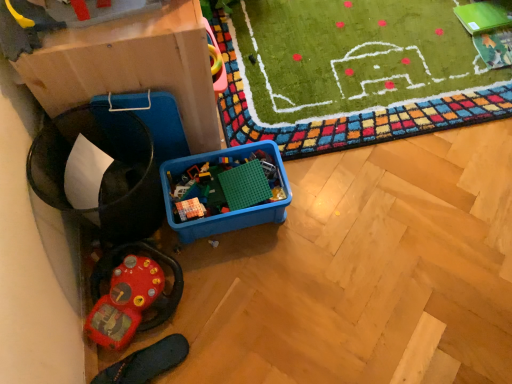
Question: Does rubberized red steering wheel at lower left, which ranks as the first toy in bottom-to-top order, contain blue plastic container at center, placed as the first toy when sorted from right to left?

Choices:
 (A) yes
 (B) no

Answer: (B)

Question: Is rubberized red steering wheel at lower left, acting as the 1th toy starting from the left, further to the viewer compared to blue plastic container at center, which ranks as the 2th toy in left-to-right order?

Choices:
 (A) no
 (B) yes

Answer: (A)

Question: Are rubberized red steering wheel at lower left, which ranks as the first toy in bottom-to-top order, and blue plastic container at center, placed as the first toy when sorted from right to left, located far from each other?

Choices:
 (A) no
 (B) yes

Answer: (A)

Question: Considering the relative sizes of rubberized red steering wheel at lower left, acting as the 1th toy starting from the left, and blue plastic container at center, which is the 2th toy in bottom-to-top order, in the image provided, is rubberized red steering wheel at lower left, acting as the 1th toy starting from the left, wider than blue plastic container at center, which is the 2th toy in bottom-to-top order,?

Choices:
 (A) no
 (B) yes

Answer: (A)

Question: Is rubberized red steering wheel at lower left, arranged as the 2th toy when viewed from the top, to the right of blue plastic container at center, the 1th toy in the top-to-bottom sequence, from the viewer's perspective?

Choices:
 (A) yes
 (B) no

Answer: (B)

Question: Relative to matte cardboard box at left, is rubberized red steering wheel at lower left, which appears as the second toy when viewed from the right, in front or behind?

Choices:
 (A) front
 (B) behind

Answer: (B)

Question: In terms of width, does rubberized red steering wheel at lower left, arranged as the 2th toy when viewed from the top, look wider or thinner when compared to matte cardboard box at left?

Choices:
 (A) wide
 (B) thin

Answer: (B)

Question: Considering the positions of rubberized red steering wheel at lower left, which ranks as the first toy in bottom-to-top order, and matte cardboard box at left in the image, is rubberized red steering wheel at lower left, which ranks as the first toy in bottom-to-top order, bigger or smaller than matte cardboard box at left?

Choices:
 (A) small
 (B) big

Answer: (A)

Question: From a real-world perspective, relative to matte cardboard box at left, is rubberized red steering wheel at lower left, arranged as the 2th toy when viewed from the top, vertically above or below?

Choices:
 (A) above
 (B) below

Answer: (B)

Question: Is blue plastic container at center, placed as the first toy when sorted from right to left, inside the boundaries of matte cardboard box at left, or outside?

Choices:
 (A) outside
 (B) inside

Answer: (A)

Question: From a real-world perspective, is blue plastic container at center, which is the 2th toy in bottom-to-top order, positioned above or below matte cardboard box at left?

Choices:
 (A) above
 (B) below

Answer: (B)

Question: Considering their positions, is blue plastic container at center, placed as the first toy when sorted from right to left, located in front of or behind matte cardboard box at left?

Choices:
 (A) behind
 (B) front

Answer: (A)

Question: Based on their positions, is blue plastic container at center, placed as the first toy when sorted from right to left, located to the left or right of matte cardboard box at left?

Choices:
 (A) right
 (B) left

Answer: (A)

Question: Is point (200, 104) positioned closer to the camera than point (96, 375)?

Choices:
 (A) closer
 (B) farther

Answer: (B)

Question: Is matte cardboard box at left taller or shorter than black rubber slipper at lower left?

Choices:
 (A) short
 (B) tall

Answer: (B)